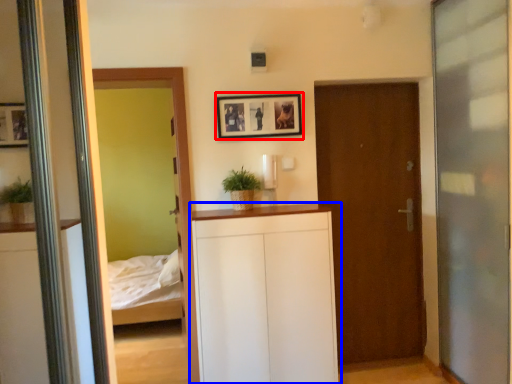
Question: Which object appears closest to the camera in this image, picture frame (highlighted by a red box) or dresser (highlighted by a blue box)?

Choices:
 (A) picture frame
 (B) dresser

Answer: (B)